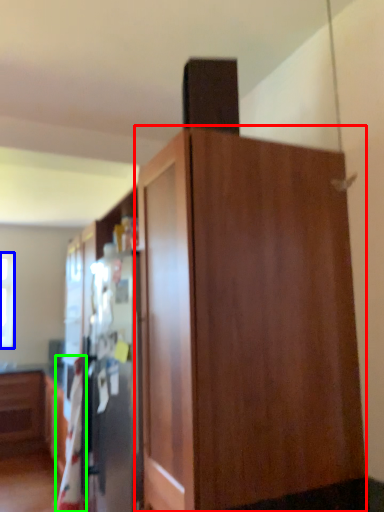
Question: Based on their relative distances, which object is nearer to cupboard (highlighted by a red box)? Choose from window (highlighted by a blue box) and blanket (highlighted by a green box).

Choices:
 (A) window
 (B) blanket

Answer: (B)